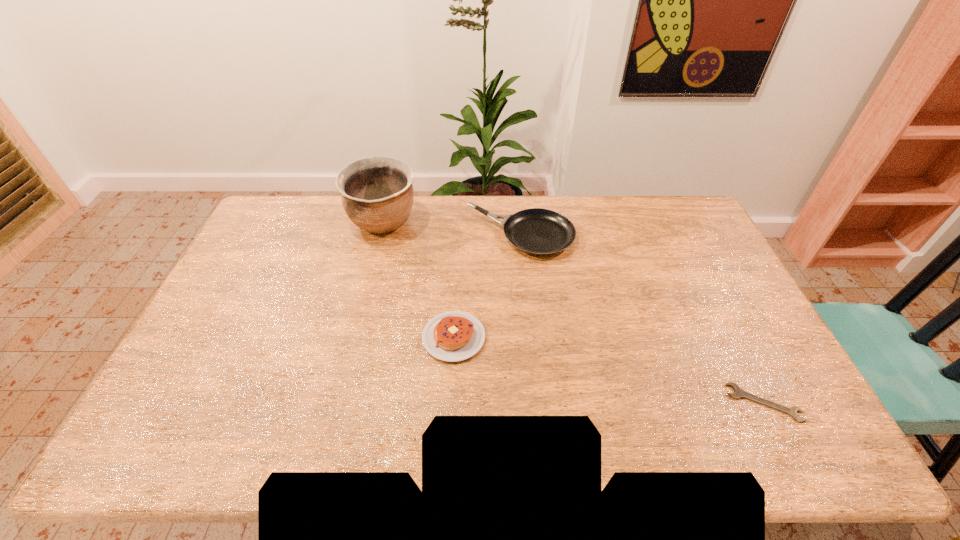
Find the location of a particular element. This screenshot has height=540, width=960. free space located on the left of the rightmost object is located at coordinates (698, 402).

At what (x,y) coordinates should I click in order to perform the action: click on pottery that is at the far edge. Please return your answer as a coordinate pair (x, y). Looking at the image, I should click on (377, 194).

At what (x,y) coordinates should I click in order to perform the action: click on pan situated at the far edge. Please return your answer as a coordinate pair (x, y). Image resolution: width=960 pixels, height=540 pixels. Looking at the image, I should click on (536, 231).

At what (x,y) coordinates should I click in order to perform the action: click on object located at the right edge. Please return your answer as a coordinate pair (x, y). The image size is (960, 540). Looking at the image, I should click on (738, 392).

This screenshot has height=540, width=960. I want to click on free location at the far edge, so click(x=501, y=230).

At what (x,y) coordinates should I click in order to perform the action: click on free spot at the near edge of the desktop. Please return your answer as a coordinate pair (x, y). Looking at the image, I should click on (700, 431).

Identify the location of free space at the left edge of the desktop. (229, 304).

The image size is (960, 540). In the image, there is a desktop. What are the coordinates of `vacant space at the right edge` in the screenshot? It's located at (739, 368).

I want to click on vacant region at the far left corner of the desktop, so click(281, 220).

You are a GUI agent. You are given a task and a screenshot of the screen. Output one action in this format:
    pyautogui.click(x=<x>, y=<y>)
    Task: Click on the vacant space at the far right corner of the desktop
    
    Given the screenshot: What is the action you would take?
    pyautogui.click(x=670, y=233)